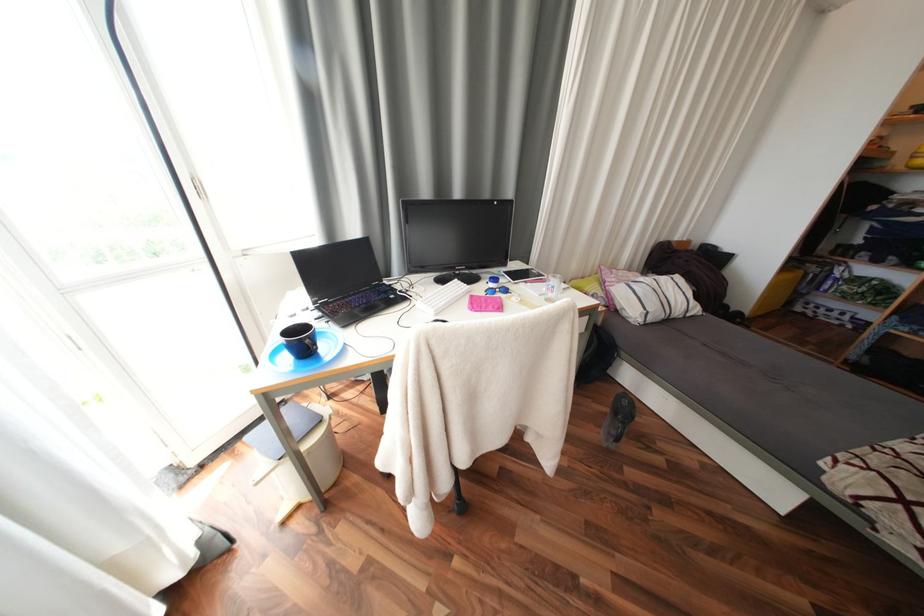
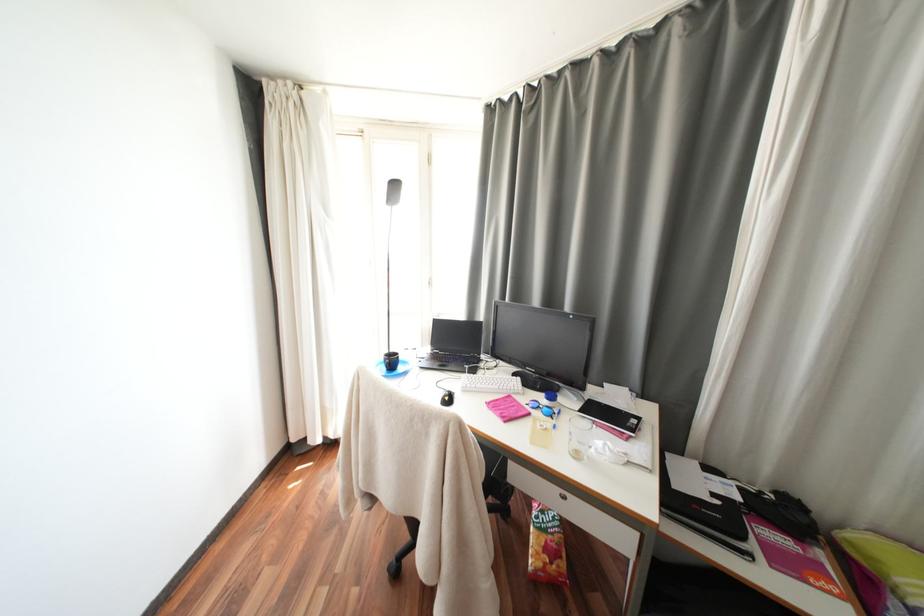
Question: The images are taken continuously from a first-person perspective. In which direction is your viewpoint rotating?

Choices:
 (A) Left
 (B) Right
 (C) Up
 (D) Down

Answer: (A)